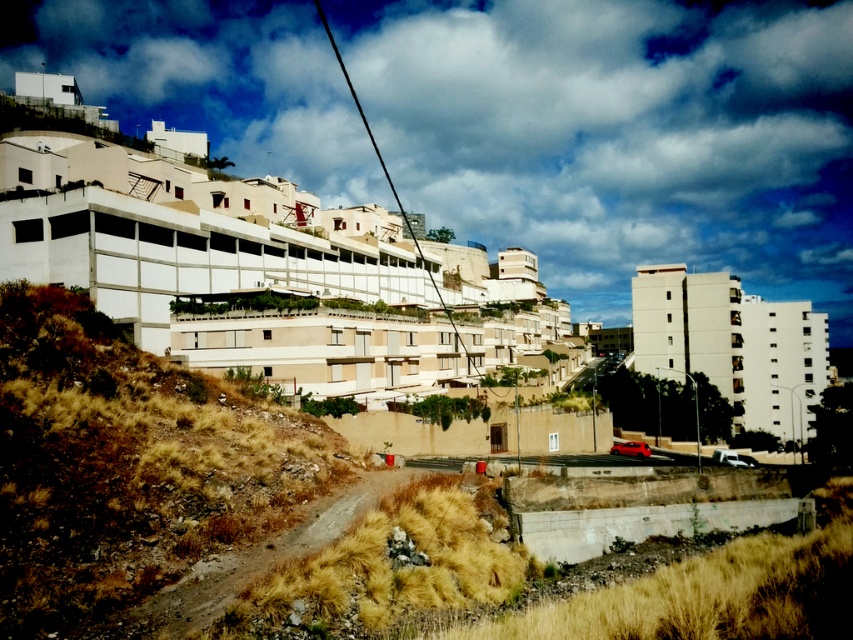
You are a hiker trying to navigate through the urban landscape shown. You see the brown grassy hillside at lower left and the brown gravel path at lower left. Which of these two features is wider?

The brown grassy hillside at lower left is wider than the brown gravel path at lower left according to the description.

You are a hiker trying to find the best route to the top of the brown grassy hillside at lower left. You notice the brown gravel path at lower left nearby. Which surface would provide better traction for climbing?

The brown gravel path at lower left would provide better traction for climbing since it is positioned below the brown grassy hillside at lower left, making it a more stable and less slippery surface.

You are standing at the point labeled as point (732, 344) in the image. What is the nearest object to you in the scene?

The nearest object to you at point (732, 344) is the white smooth building at center right, as the point directly indicates its location.